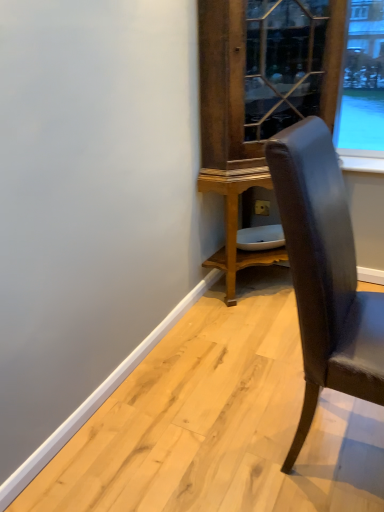
Find the location of `vacant space behind leather chair at right`. vacant space behind leather chair at right is located at coordinates (255, 364).